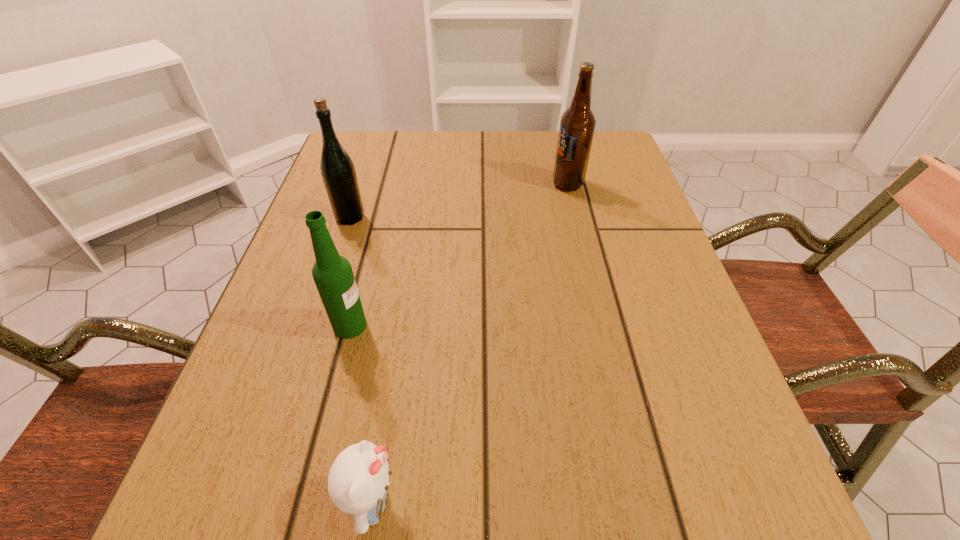
This screenshot has width=960, height=540. Find the location of `object that ranks as the third closest to the second nearest beer bottle`. object that ranks as the third closest to the second nearest beer bottle is located at coordinates (358, 480).

I want to click on the closest beer bottle to the third nearest object, so click(x=332, y=273).

I want to click on beer bottle that is the closest to the farthest object, so click(338, 172).

In order to click on vacant space that satisfies the following two spatial constraints: 1. on the label of the rightmost beer bottle; 2. on the front side of the leftmost object in this screenshot , I will do `click(576, 217)`.